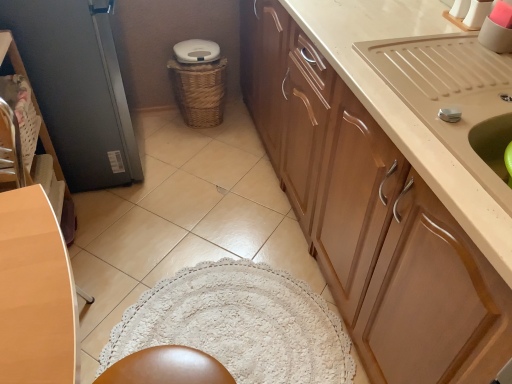
Question: Relative to metallic gray screen door at left, is beige glossy sink at upper right in front or behind?

Choices:
 (A) front
 (B) behind

Answer: (A)

Question: From a real-world perspective, is beige glossy sink at upper right above or below metallic gray screen door at left?

Choices:
 (A) below
 (B) above

Answer: (B)

Question: Which object is positioned closest to the beige glossy sink at upper right?

Choices:
 (A) woven brown basket at center
 (B) wooden cabinet at upper right
 (C) metallic gray screen door at left
 (D) matte brown chair at left

Answer: (B)

Question: Which of these objects is positioned closest to the woven brown basket at center?

Choices:
 (A) wooden cabinet at upper right
 (B) matte brown chair at left
 (C) beige glossy sink at upper right
 (D) metallic gray screen door at left

Answer: (D)